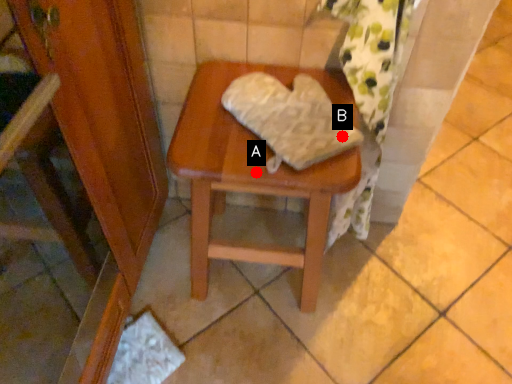
Question: Two points are circled on the image, labeled by A and B beside each circle. Which point is closer to the camera taking this photo?

Choices:
 (A) A is closer
 (B) B is closer

Answer: (A)